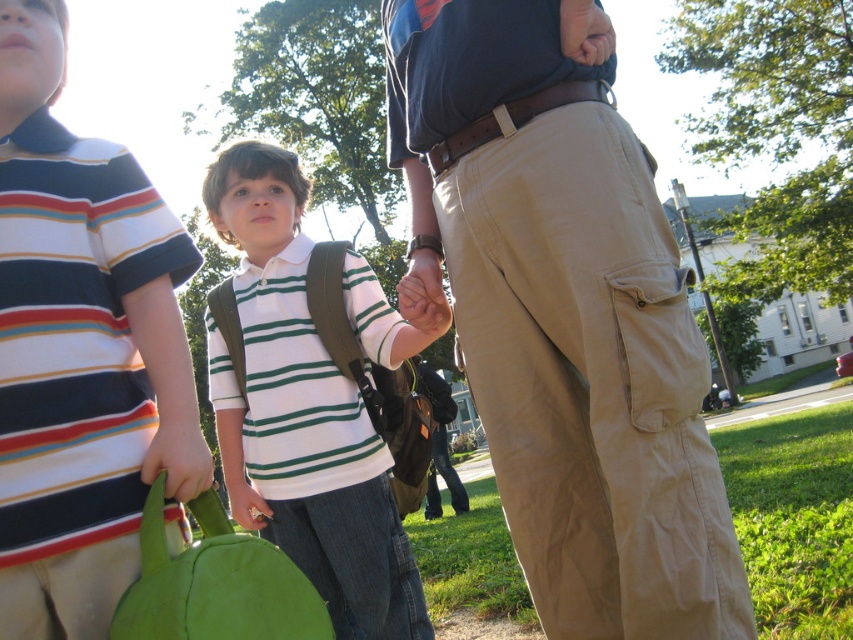
Between khaki pants at center and matte green bag at lower left, which one is positioned lower?

matte green bag at lower left is below.

Who is more forward, (572, 364) or (268, 518)?

Point (572, 364) is in front.

This screenshot has width=853, height=640. Identify the location of khaki pants at center. (566, 317).

Is point (444, 410) behind point (252, 515)?

Yes, it is behind point (252, 515).

Identify the location of black leather jacket at lower center. The image size is (853, 640). (439, 442).

Consider the image. Is green fabric bag at lower left closer to the viewer compared to black leather jacket at lower center?

Yes, it is.

Measure the distance between green fabric bag at lower left and black leather jacket at lower center.

The distance of green fabric bag at lower left from black leather jacket at lower center is 2.47 meters.

Who is more forward, (300, 637) or (418, 368)?

Point (300, 637) is more forward.

The image size is (853, 640). Identify the location of green fabric bag at lower left. (215, 582).